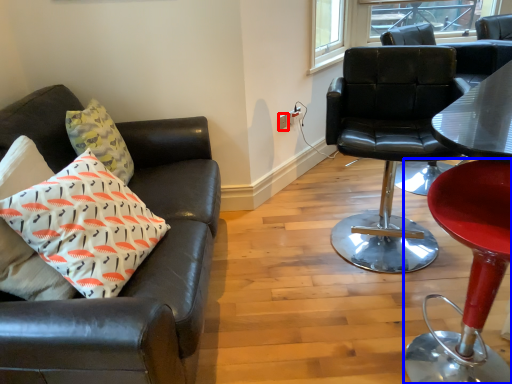
Question: Which point is further to the camera, power outlet (highlighted by a red box) or chair (highlighted by a blue box)?

Choices:
 (A) power outlet
 (B) chair

Answer: (A)